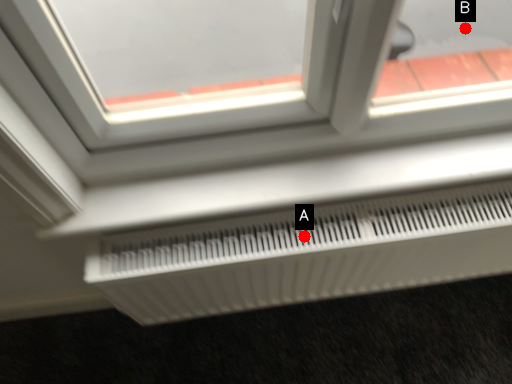
Question: Two points are circled on the image, labeled by A and B beside each circle. Which point is closer to the camera?

Choices:
 (A) A is closer
 (B) B is closer

Answer: (A)